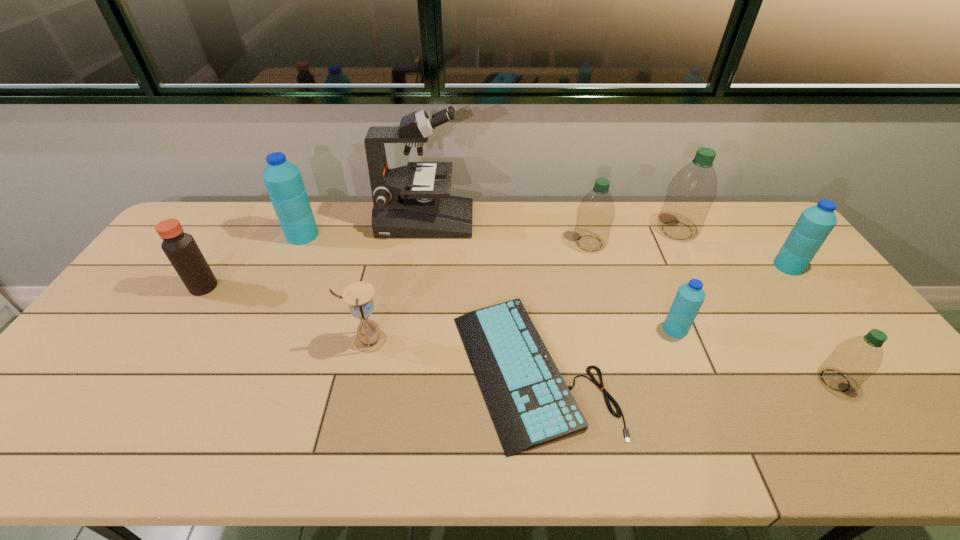
Locate an element on the screen. the tallest object is located at coordinates (408, 203).

This screenshot has width=960, height=540. Find the location of `the third object from right to left`. the third object from right to left is located at coordinates (692, 191).

The image size is (960, 540). Find the location of `the biggest green water bottle`. the biggest green water bottle is located at coordinates (692, 191).

Where is `the farthest blue water bottle`? The height and width of the screenshot is (540, 960). the farthest blue water bottle is located at coordinates (283, 180).

Locate an element on the screen. The height and width of the screenshot is (540, 960). the biggest blue water bottle is located at coordinates (283, 180).

Identify the location of the leftmost green water bottle. The height and width of the screenshot is (540, 960). (596, 212).

What are the coordinates of `the fifth water bottle from right to left` in the screenshot? It's located at (596, 212).

This screenshot has width=960, height=540. What are the coordinates of `the rightmost blue water bottle` in the screenshot? It's located at (815, 223).

Find the location of a particular element. The width and height of the screenshot is (960, 540). the second farthest blue water bottle is located at coordinates (815, 223).

Where is `vinegar`? This screenshot has width=960, height=540. vinegar is located at coordinates (181, 249).